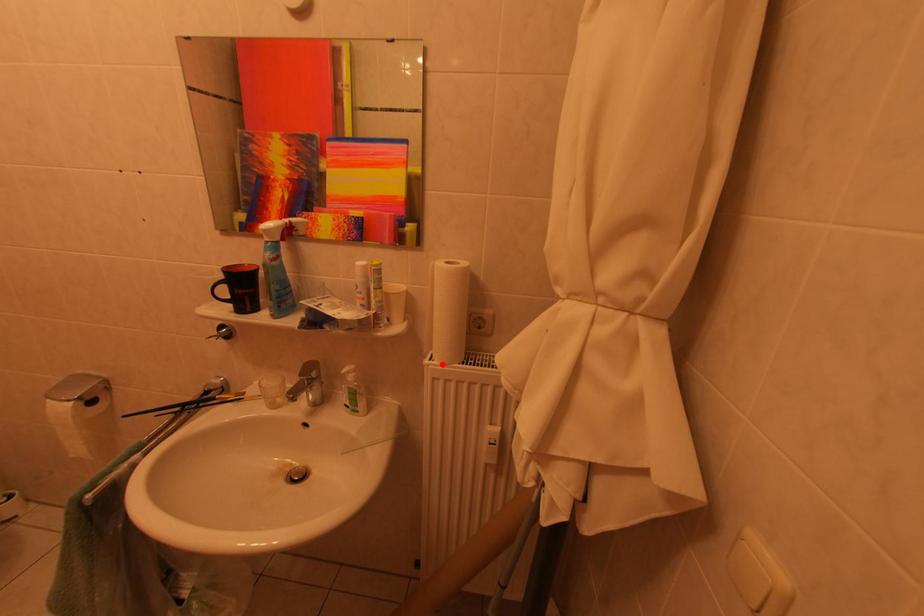
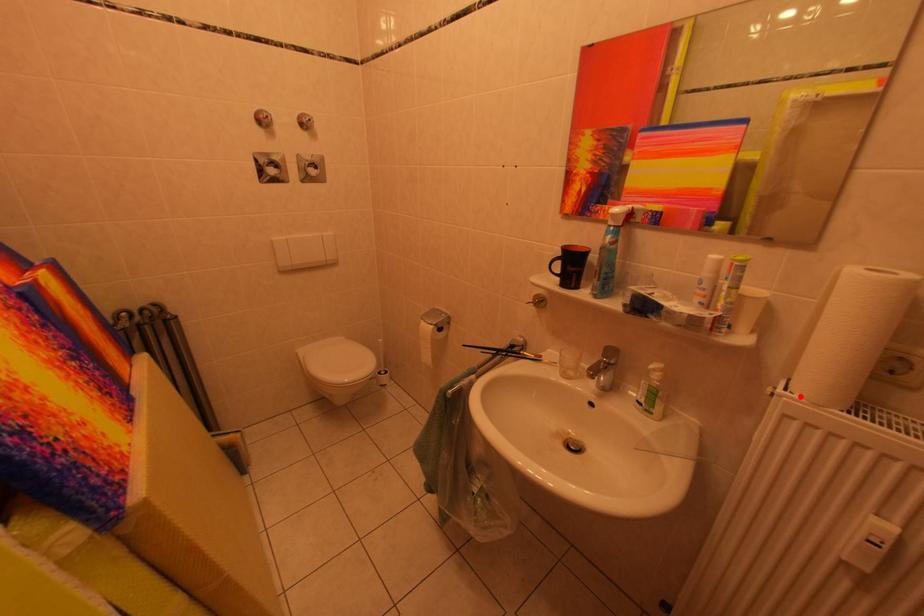
I am providing you with two images of the same scene from different viewpoints. A red point is marked on the first image and another point is marked on the second image. Do the highlighted points in image1 and image2 indicate the same real-world spot?

Yes